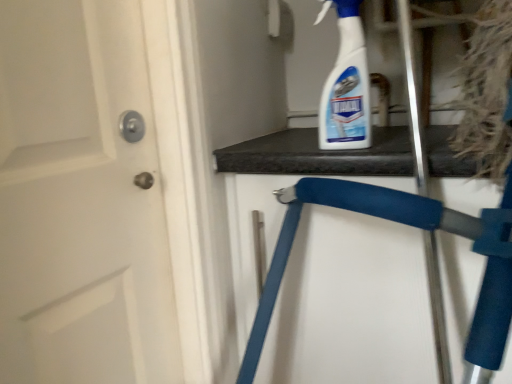
Question: Visually, is blue foam folding chair at upper center positioned to the left or to the right of white plastic spray bottle at upper right?

Choices:
 (A) left
 (B) right

Answer: (B)

Question: Does point [x=426, y=210] appear closer or farther from the camera than point [x=330, y=102]?

Choices:
 (A) farther
 (B) closer

Answer: (B)

Question: From a real-world perspective, relative to white plastic spray bottle at upper right, is blue foam folding chair at upper center vertically above or below?

Choices:
 (A) below
 (B) above

Answer: (A)

Question: Is point (350, 97) closer or farther from the camera than point (272, 259)?

Choices:
 (A) closer
 (B) farther

Answer: (A)

Question: Visually, is white plastic spray bottle at upper right positioned to the left or to the right of blue foam folding chair at upper center?

Choices:
 (A) right
 (B) left

Answer: (B)

Question: Based on their sizes in the image, would you say white plastic spray bottle at upper right is bigger or smaller than blue foam folding chair at upper center?

Choices:
 (A) small
 (B) big

Answer: (A)

Question: In terms of height, does white plastic spray bottle at upper right look taller or shorter compared to blue foam folding chair at upper center?

Choices:
 (A) short
 (B) tall

Answer: (A)